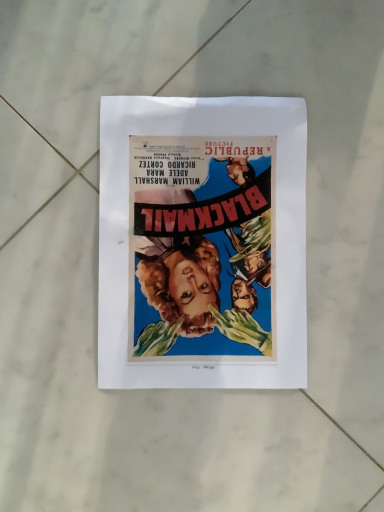
You are a GUI agent. You are given a task and a screenshot of the screen. Output one action in this format:
    pyautogui.click(x=<x>, y=<y>)
    Task: Click on the free space above vibrant paper poster at center (from a real-world perspective)
    The height and width of the screenshot is (512, 384).
    Given the screenshot: What is the action you would take?
    pyautogui.click(x=204, y=244)